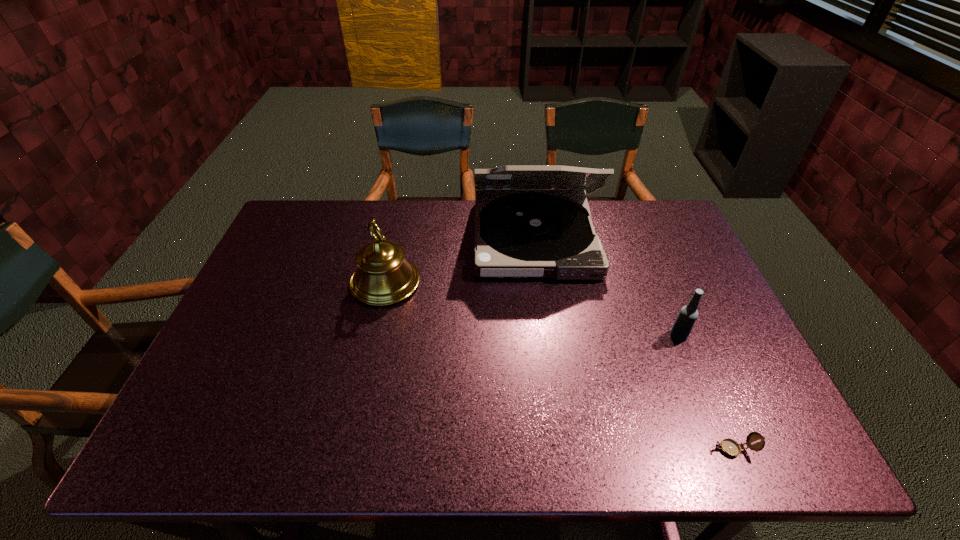
Locate an element on the screen. the tallest object is located at coordinates (526, 231).

The image size is (960, 540). I want to click on CD player, so click(x=526, y=231).

This screenshot has height=540, width=960. Identify the location of the leftmost object. (383, 277).

At what (x,y) coordinates should I click in order to perform the action: click on the second tallest object. Please return your answer as a coordinate pair (x, y). The image size is (960, 540). Looking at the image, I should click on (383, 277).

This screenshot has height=540, width=960. Identify the location of the third tallest object. (687, 316).

What are the coordinates of `bottle` in the screenshot? It's located at (687, 316).

Locate an element on the screen. Image resolution: width=960 pixels, height=540 pixels. compass is located at coordinates [728, 446].

Find the location of `the shortest object`. the shortest object is located at coordinates (728, 446).

You are a GUI agent. You are given a task and a screenshot of the screen. Output one action in this format:
    pyautogui.click(x=<x>, y=<y>)
    Task: Click on the vacant area located on the control panel of the tallest object
    This screenshot has height=540, width=960.
    Given the screenshot: What is the action you would take?
    pyautogui.click(x=557, y=400)

Identify the location of blank space located 0.290m on the left of the leftmost object. Image resolution: width=960 pixels, height=540 pixels. (252, 283).